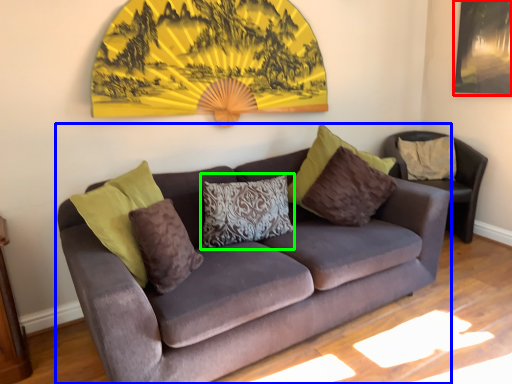
Question: Which object is the farthest from picture frame (highlighted by a red box)? Choose among these: studio couch (highlighted by a blue box) or pillow (highlighted by a green box).

Choices:
 (A) studio couch
 (B) pillow

Answer: (B)